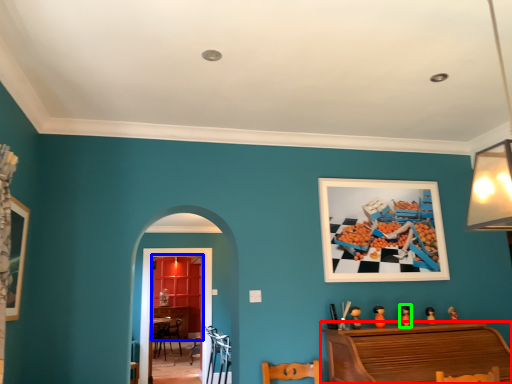
Question: Considering the real-world distances, which object is farthest from furniture (highlighted by a red box)? dresser (highlighted by a blue box) or toy (highlighted by a green box)?

Choices:
 (A) dresser
 (B) toy

Answer: (A)